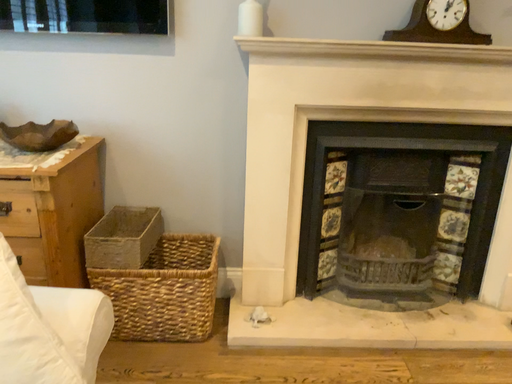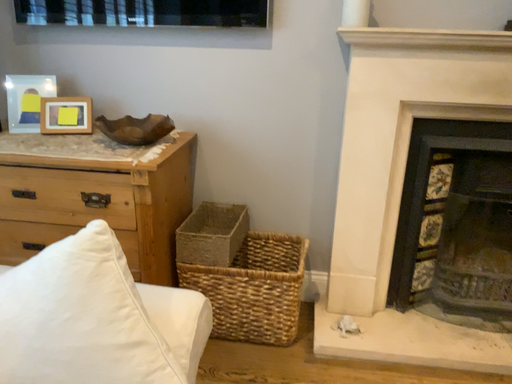
Question: Which way did the camera rotate in the video?

Choices:
 (A) rotated left
 (B) rotated right

Answer: (A)